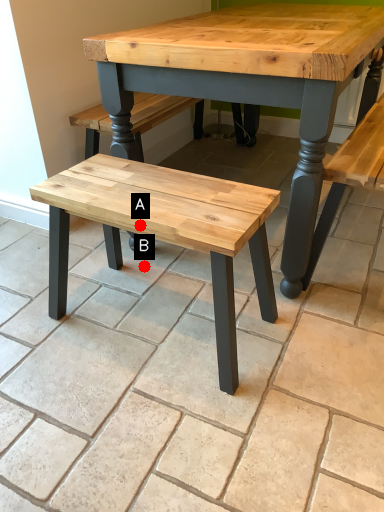
Question: Two points are circled on the image, labeled by A and B beside each circle. Which point appears closest to the camera in this image?

Choices:
 (A) A is closer
 (B) B is closer

Answer: (A)